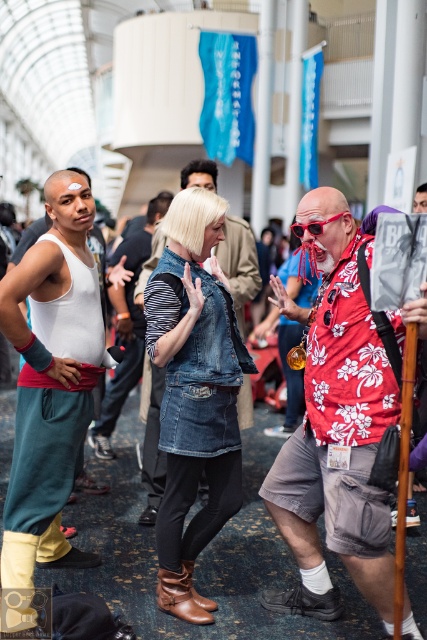
Question: Is white matte tank top at left in front of sunglasses at center?

Choices:
 (A) no
 (B) yes

Answer: (B)

Question: Which object appears closest to the camera in this image?

Choices:
 (A) denim vest at center
 (B) white matte tank top at left
 (C) white cotton tank top at center
 (D) floral print shirt at center

Answer: (D)

Question: Which of the following is the closest to the observer?

Choices:
 (A) (295, 221)
 (B) (63, 236)

Answer: (B)

Question: Can you confirm if floral print shirt at center is bigger than denim vest at center?

Choices:
 (A) no
 (B) yes

Answer: (B)

Question: Which object appears closest to the camera in this image?

Choices:
 (A) denim vest at center
 (B) sunglasses at center

Answer: (B)

Question: Can you confirm if floral print shirt at center is wider than white cotton tank top at center?

Choices:
 (A) no
 (B) yes

Answer: (B)